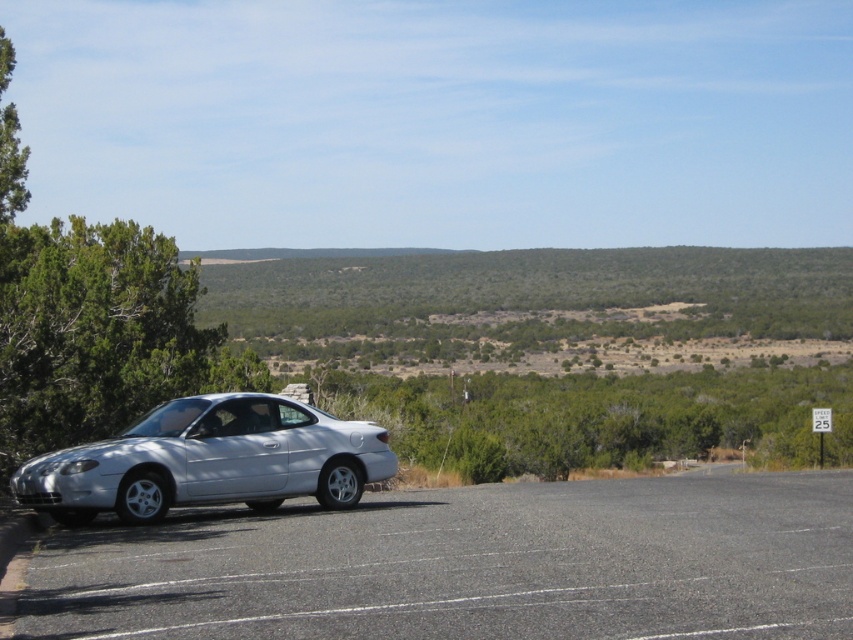
You are standing at the edge of the gray asphalt parking lot at lower left and want to see the satin silver car at left. Is the parking lot lower or higher than the car?

The gray asphalt parking lot at lower left has a lesser height compared to the satin silver car at left, so the parking lot is lower than the car.